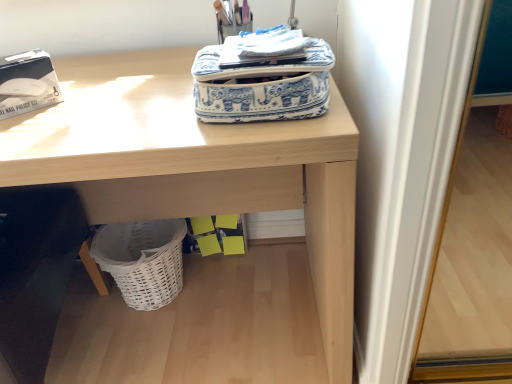
The image size is (512, 384). I want to click on vacant area in front of white wicker basket at lower left, so click(x=147, y=345).